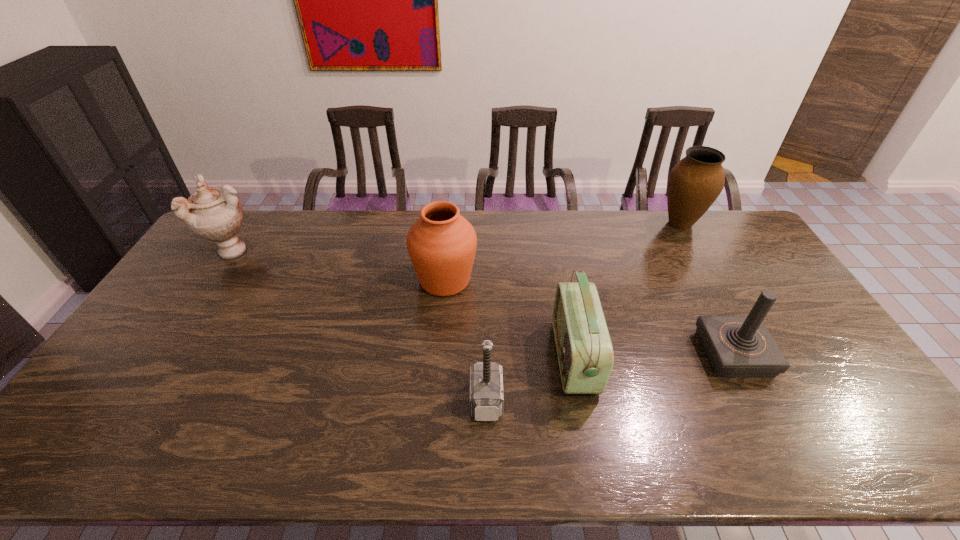
Where is `vacant space in between the hammer and the fourth object from left to right`? The width and height of the screenshot is (960, 540). vacant space in between the hammer and the fourth object from left to right is located at coordinates (530, 379).

I want to click on free point between the rightmost urn and the joystick, so click(x=707, y=289).

The image size is (960, 540). Identify the location of unoccupied area between the hammer and the fourth object from left to right. (530, 379).

Identify which object is the second nearest to the second urn from left to right. Please provide its 2D coordinates. Your answer should be formatted as a tuple, i.e. [(x, y)], where the tuple contains the x and y coordinates of a point satisfying the conditions above.

[(486, 378)]

What are the coordinates of `the second closest object to the radio receiver` in the screenshot? It's located at (441, 244).

You are a GUI agent. You are given a task and a screenshot of the screen. Output one action in this format:
    pyautogui.click(x=<x>, y=<y>)
    Task: Click on the closest urn to the second urn from left to right
    
    Given the screenshot: What is the action you would take?
    pyautogui.click(x=214, y=214)

Find the location of a particular element. The image size is (960, 540). urn that can be found as the second closest to the second urn from right to left is located at coordinates (695, 182).

This screenshot has width=960, height=540. Identify the location of vacant space that satisfies the following two spatial constraints: 1. on the front side of the rightmost urn; 2. on the front panel of the radio receiver. (755, 357).